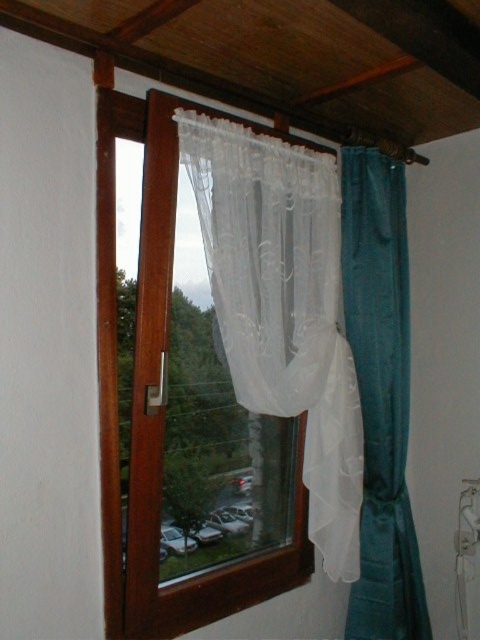
You are standing in the room and want to open the window. The window has a handle on its left side. Is the white sheer curtain at center in the way of the handle?

The white sheer curtain at center is located at point (284,307), which is at the center of the window. The handle is on the left side, so the white sheer curtain at center is not blocking the handle.

You are standing in the room and want to look outside through the window. Which object at point (158, 408) should you look through?

The transparent plastic window at center is located at point (158, 408), so you should look through the transparent plastic window at center to see outside.

You have a 10 inch wide painting that you want to hang between the white sheer curtain at center and the transparent plastic window at center. Can it fit?

The white sheer curtain at center and transparent plastic window at center are 9.01 inches apart from each other. Since the painting is 10 inches wide, it cannot fit in the space between them.